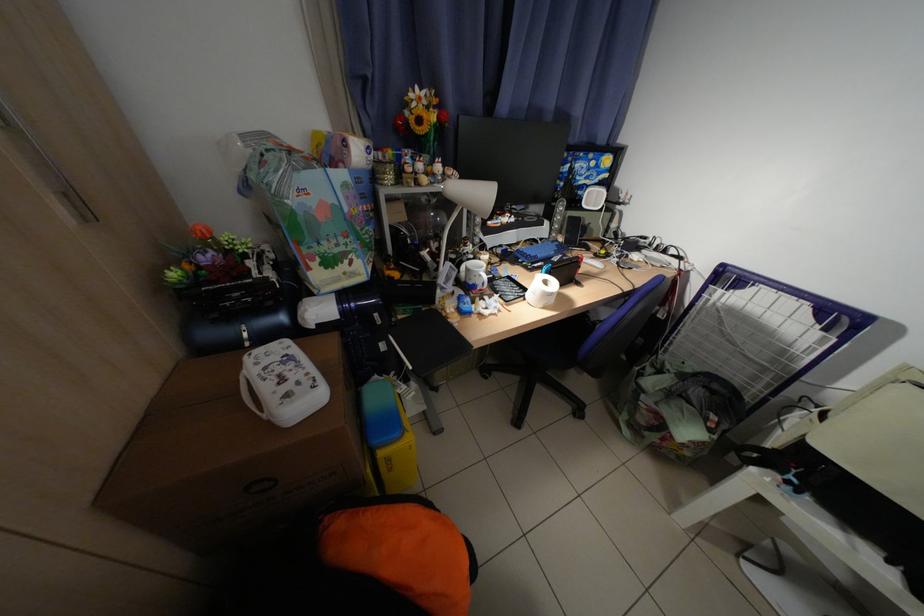
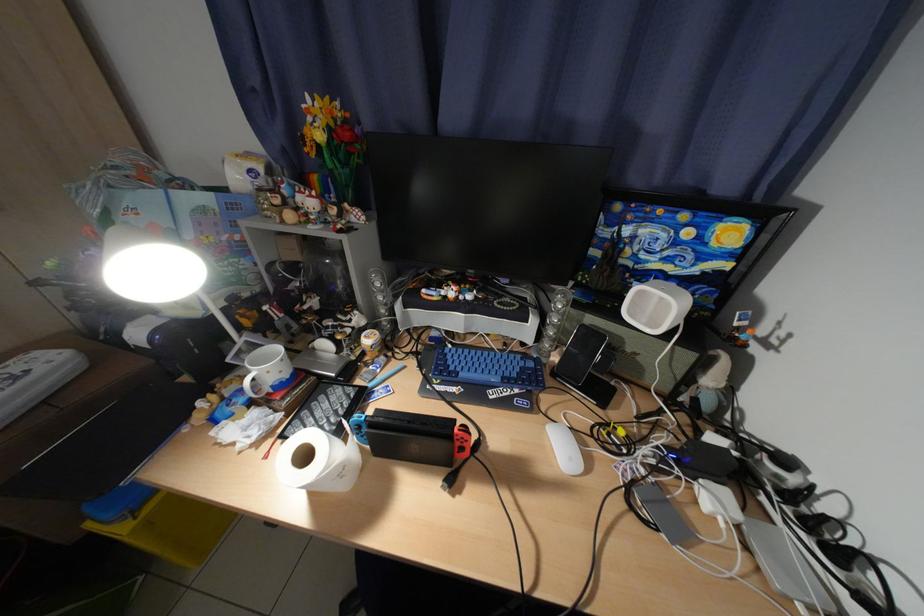
Find the pixel in the second image that matches the point at 445,120 in the first image.

(331, 138)